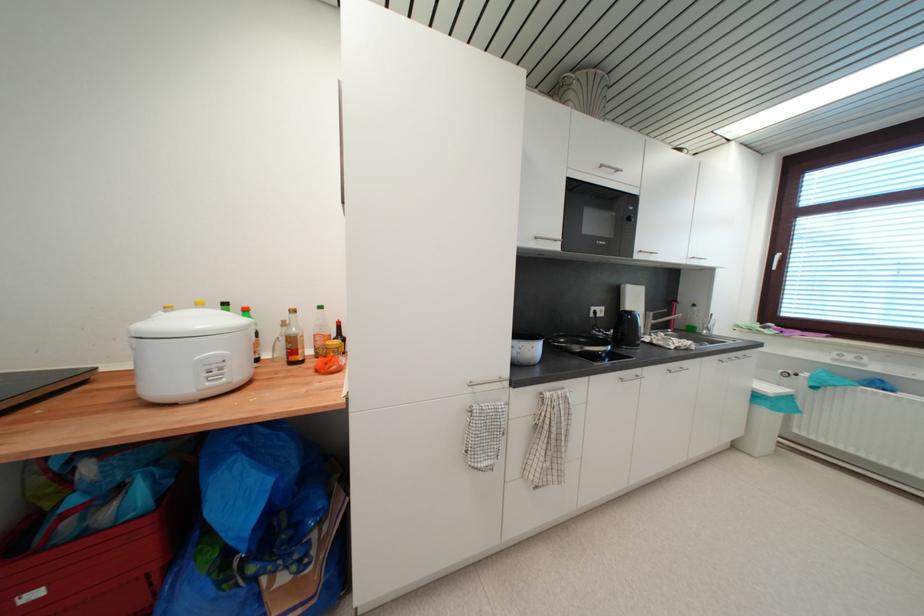
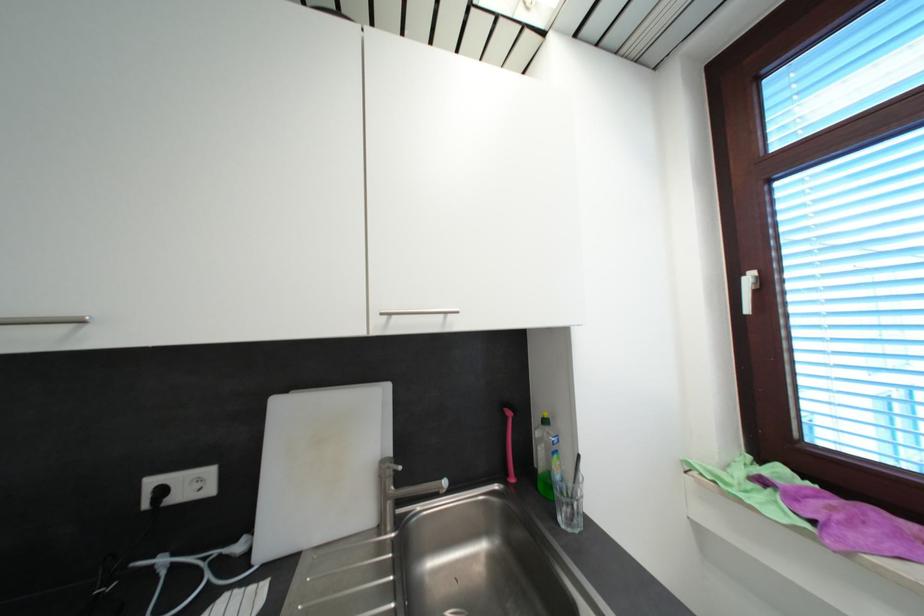
Which direction would the cameraman need to move to produce the second image?

The cameraman walked toward right, forward.